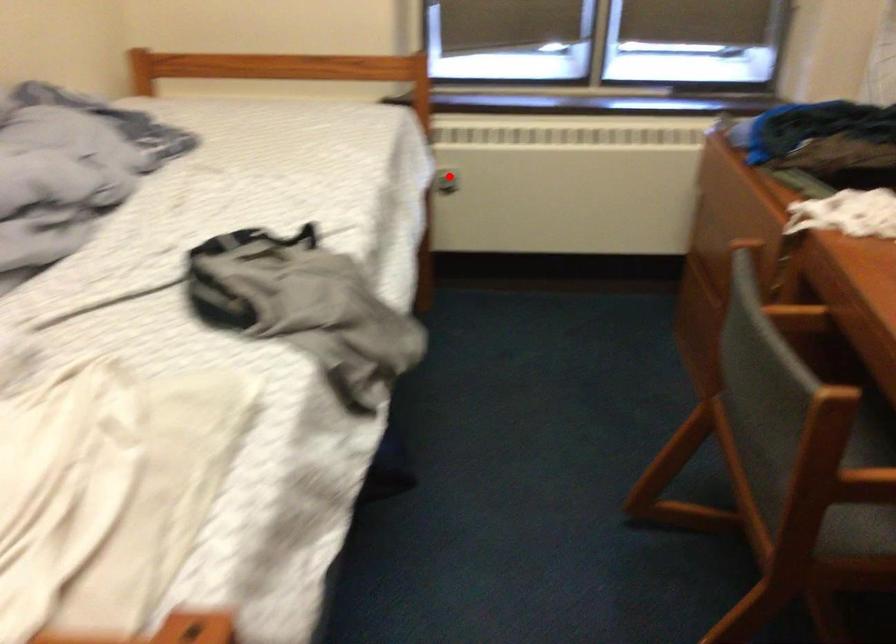
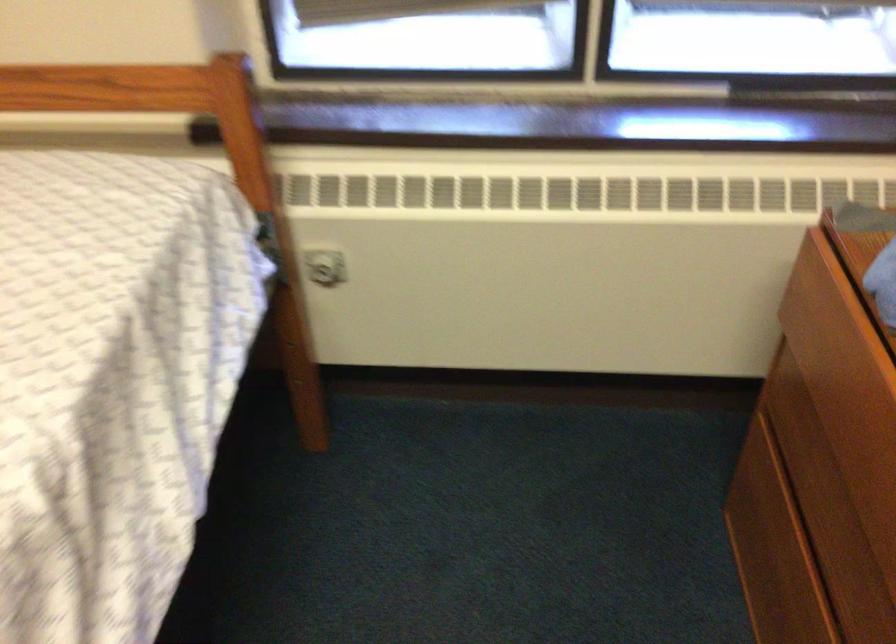
Question: I am providing you with two images of the same scene from different viewpoints. Image1 has a red point marked. In image2, the corresponding 3D location appears at what relative position? Reply with the corresponding letter.

Choices:
 (A) Closer
 (B) Farther

Answer: (A)